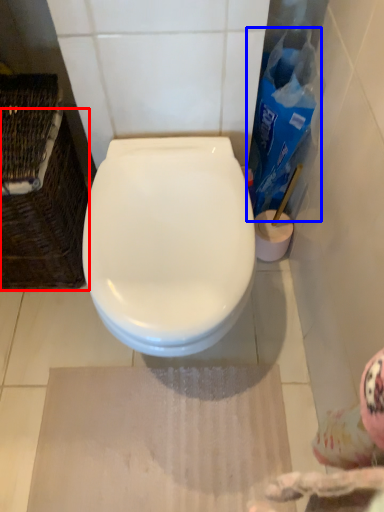
Question: Which of the following is the closest to the observer, basket (highlighted by a red box) or cleaning product (highlighted by a blue box)?

Choices:
 (A) basket
 (B) cleaning product

Answer: (A)